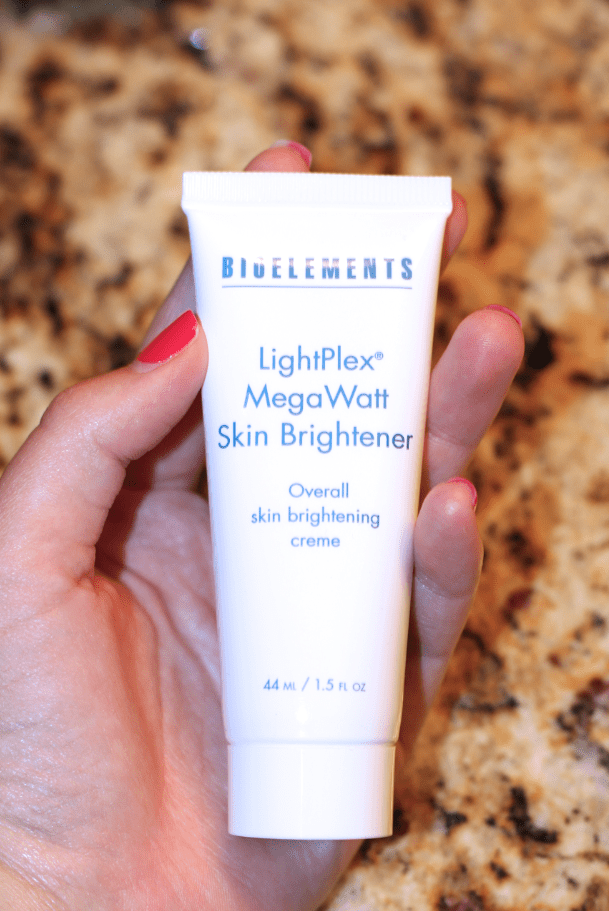
Locate an element on the screen. stone countertop is located at coordinates (536, 756).